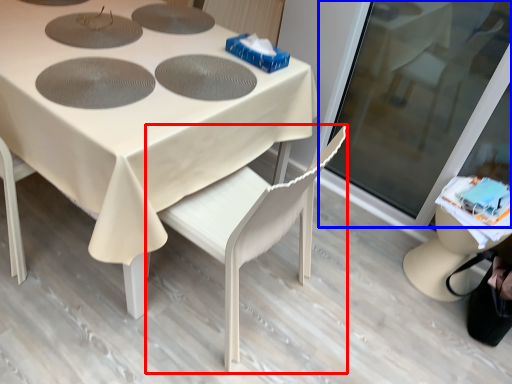
Question: Which object is further to the camera taking this photo, chair (highlighted by a red box) or screen door (highlighted by a blue box)?

Choices:
 (A) chair
 (B) screen door

Answer: (B)